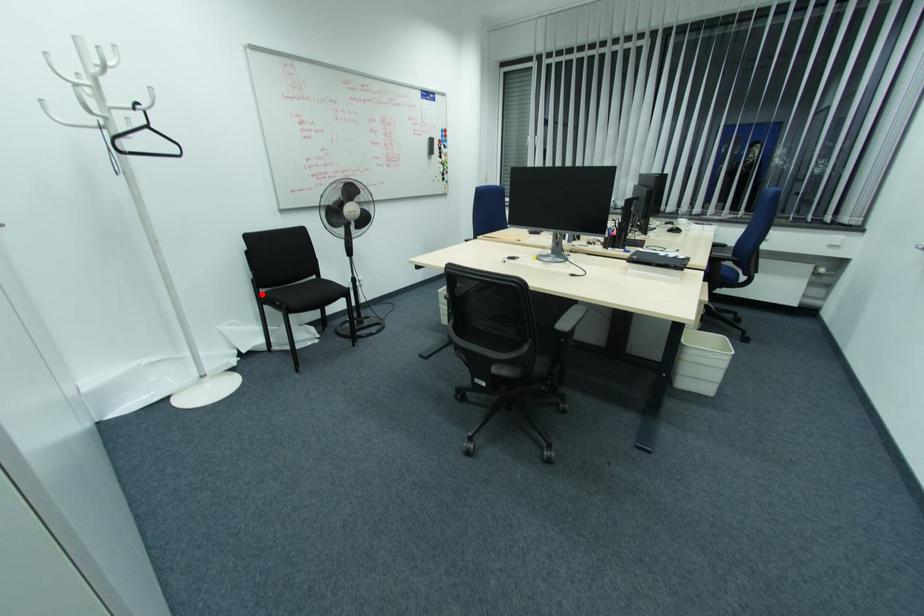
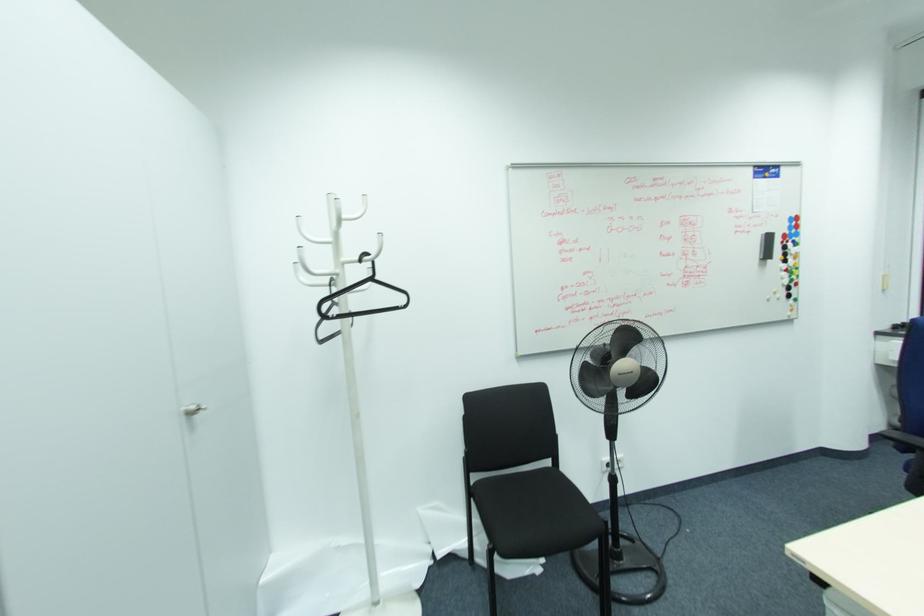
Question: I am providing you with two images of the same scene from different viewpoints. Given a red point in image1, look at the same physical point in image2. Is it:

Choices:
 (A) Closer to the viewpoint
 (B) Farther from the viewpoint

Answer: (B)